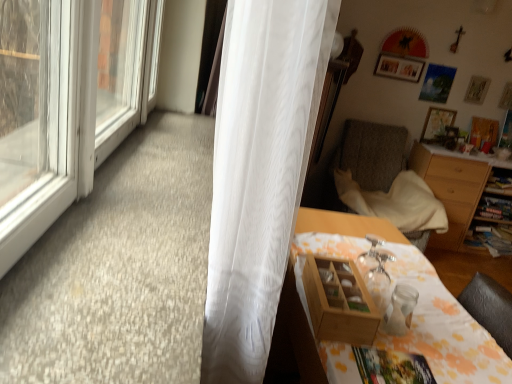
Question: Can you confirm if textured gray chair at right is thinner than wooden cabinet at right?

Choices:
 (A) yes
 (B) no

Answer: (B)

Question: From the image's perspective, does textured gray chair at right appear higher than wooden cabinet at right?

Choices:
 (A) yes
 (B) no

Answer: (A)

Question: Does textured gray chair at right have a smaller size compared to wooden cabinet at right?

Choices:
 (A) no
 (B) yes

Answer: (A)

Question: Is the depth of textured gray chair at right greater than that of wooden cabinet at right?

Choices:
 (A) no
 (B) yes

Answer: (A)

Question: Is textured gray chair at right positioned beyond the bounds of wooden cabinet at right?

Choices:
 (A) yes
 (B) no

Answer: (A)

Question: From the image's perspective, is textured gray chair at right under wooden cabinet at right?

Choices:
 (A) no
 (B) yes

Answer: (A)

Question: Is wooden desk at lower right positioned beyond the bounds of wooden cabinet at right?

Choices:
 (A) no
 (B) yes

Answer: (B)

Question: Can you confirm if wooden desk at lower right is wider than wooden cabinet at right?

Choices:
 (A) yes
 (B) no

Answer: (A)

Question: Considering the relative sizes of wooden desk at lower right and wooden cabinet at right in the image provided, is wooden desk at lower right smaller than wooden cabinet at right?

Choices:
 (A) yes
 (B) no

Answer: (B)

Question: Is the depth of wooden desk at lower right greater than that of wooden cabinet at right?

Choices:
 (A) no
 (B) yes

Answer: (A)

Question: Would you consider wooden desk at lower right to be distant from wooden cabinet at right?

Choices:
 (A) yes
 (B) no

Answer: (A)

Question: Does wooden desk at lower right appear on the right side of wooden cabinet at right?

Choices:
 (A) yes
 (B) no

Answer: (B)

Question: Is white sheer curtain at left closer to camera compared to wooden picture frame at upper right, which is counted as the 2th picture frame, starting from the left?

Choices:
 (A) yes
 (B) no

Answer: (A)